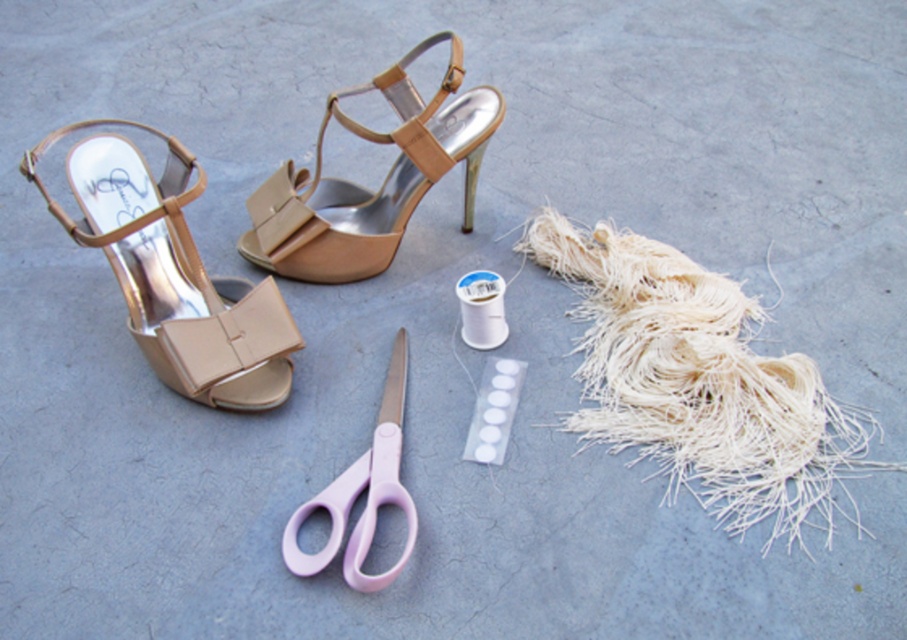
You are organizing a craft station and need to place the white frayed yarn at lower right and the matte beige sandal at left. According to the image, which object is located to the right of the other?

The white frayed yarn at lower right is positioned on the right side of matte beige sandal at left.

Consider the image. You are organizing a craft station and need to place the white frayed yarn at lower right and the matte beige sandal at left on a shelf. The shelf has a maximum length of 30 inches. Can both items be placed side by side without overlapping?

The distance between the white frayed yarn at lower right and matte beige sandal at left is 27.76 inches, which is less than the shelf length of 30 inches. Therefore, both items can be placed side by side without overlapping.

You are organizing a craft station and need to place the white frayed yarn at lower right and the pink plastic scissors at center. If you want to arrange them so that the taller item is behind the shorter one, which item should be placed in front?

The pink plastic scissors at center should be placed in front because the white frayed yarn at lower right is taller, so it should be placed behind.